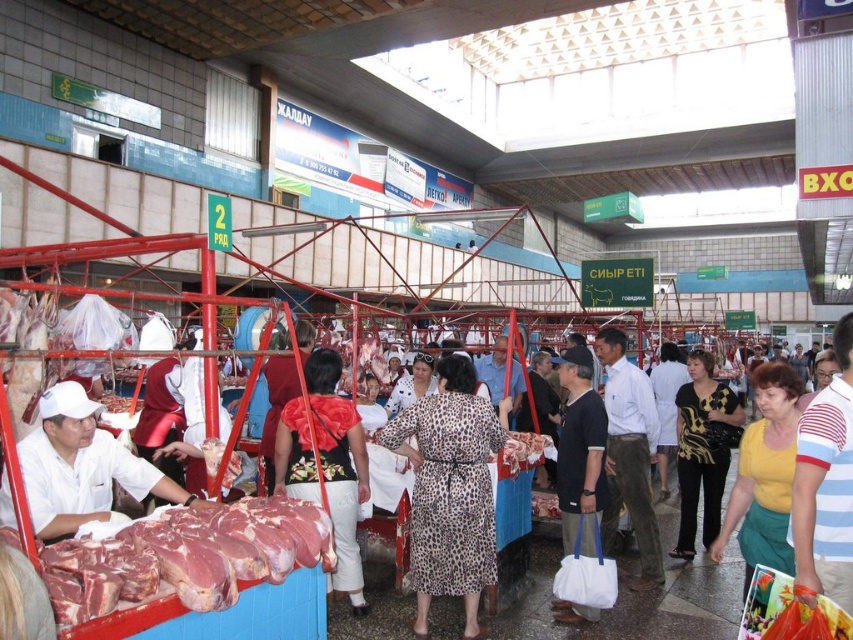
You are a customer at the market and want to know if your dark blue cotton shirt at center can fit into a bag that can only hold items narrower than the raw meat at center. Can it fit?

The dark blue cotton shirt at center has a width less than the raw meat at center, so it can fit into the bag.

You are a customer in the market and want to place your groceries on the white cloth at center. Where exactly should you place them?

The white cloth at center is located at point (82, 467), so you should place your groceries there.